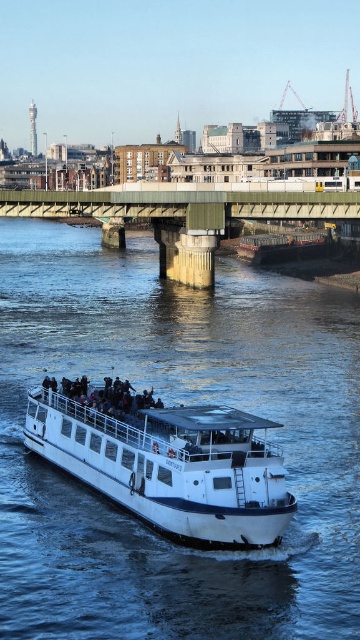
You are a photographer on the white glossy boat at center and want to take a photo of the white matte boat at center. Which direction should you move your camera to capture it?

The white glossy boat at center is positioned on the right side of the white matte boat at center, so you should move your camera to the left to capture the white matte boat at center.

You are a photographer planning to capture a wide shot of the River Thames. You need to ensure both the white glossy boat at center and the white matte boat at center are fully visible in your frame. Given that your camera has a limited field of view, which boat should you position closer to the center of your frame to maximize their visibility?

To maximize visibility of both the white glossy boat at center and the white matte boat at center, you should position the white glossy boat at center closer to the center of your frame. Since it is bigger, placing it centrally ensures it doesn not get cropped while the smaller white matte boat at center can be accommodated on the sides.

You are on a sightseeing tour boat on the River Thames. You notice the blue water at center and the metallic gray barge at center. Which object is closer to you?

The blue water at center is closer to the viewer than the metallic gray barge at center.